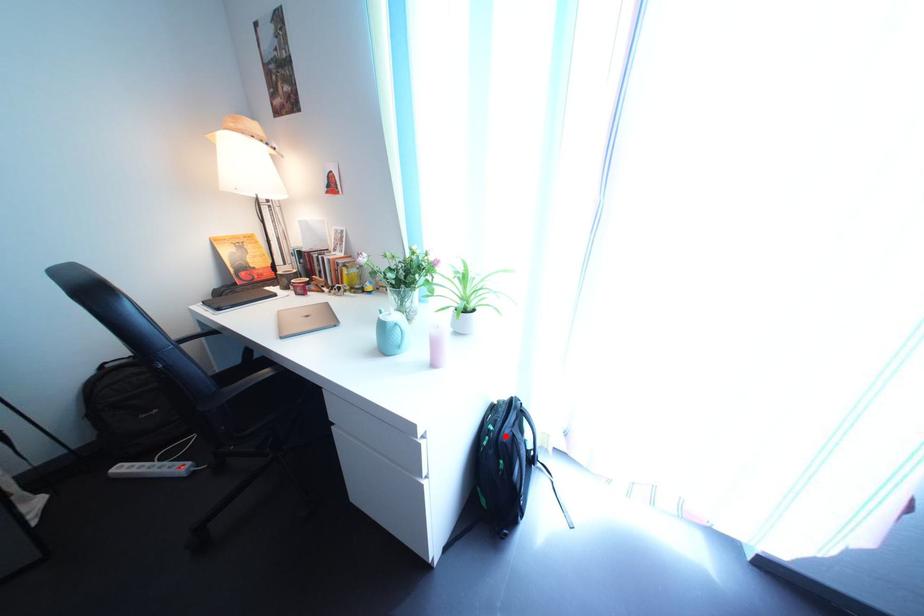
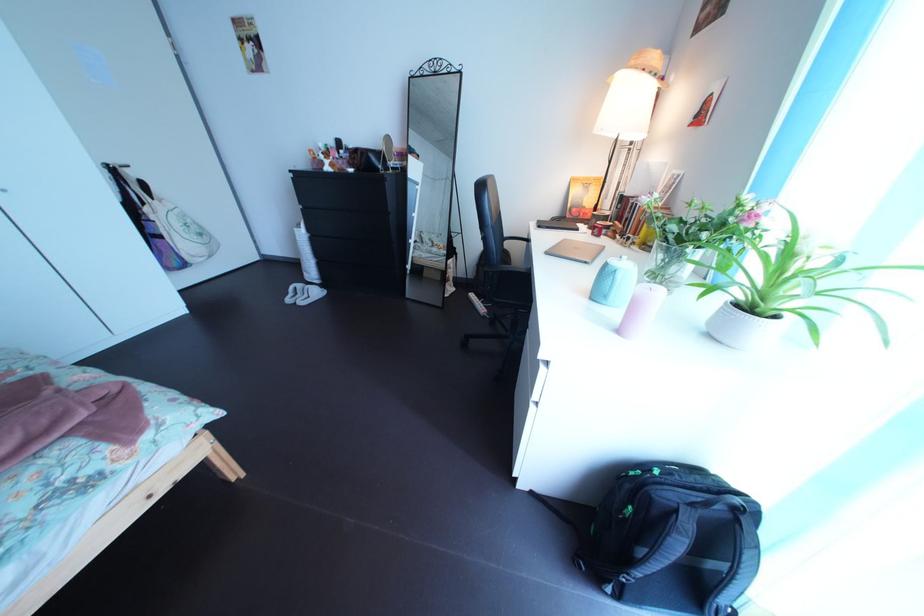
Find the pixel in the second image that matches the highlighted location in the first image.

(672, 480)